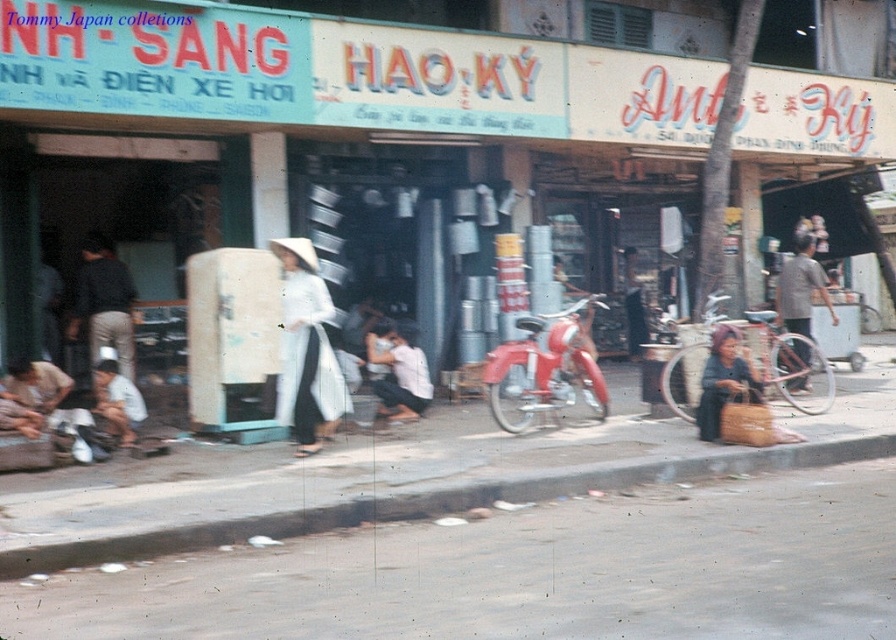
Question: Does gray concrete curb at lower center have a larger size compared to dark gray fabric pants at left?

Choices:
 (A) yes
 (B) no

Answer: (B)

Question: Which of the following is the farthest from the observer?

Choices:
 (A) (722, 324)
 (B) (55, 532)

Answer: (A)

Question: Among these objects, which one is nearest to the camera?

Choices:
 (A) dark gray fabric pants at left
 (B) gray concrete curb at lower center

Answer: (B)

Question: Is the position of white silk ao dai at center more distant than that of gray cotton shirt at center?

Choices:
 (A) no
 (B) yes

Answer: (A)

Question: Does gray concrete curb at lower center appear under white fabric dress at center?

Choices:
 (A) no
 (B) yes

Answer: (B)

Question: Which object is positioned farthest from the smooth concrete pavement at center?

Choices:
 (A) dark blue fabric bag at lower right
 (B) white fabric dress at center
 (C) dark gray fabric pants at left

Answer: (C)